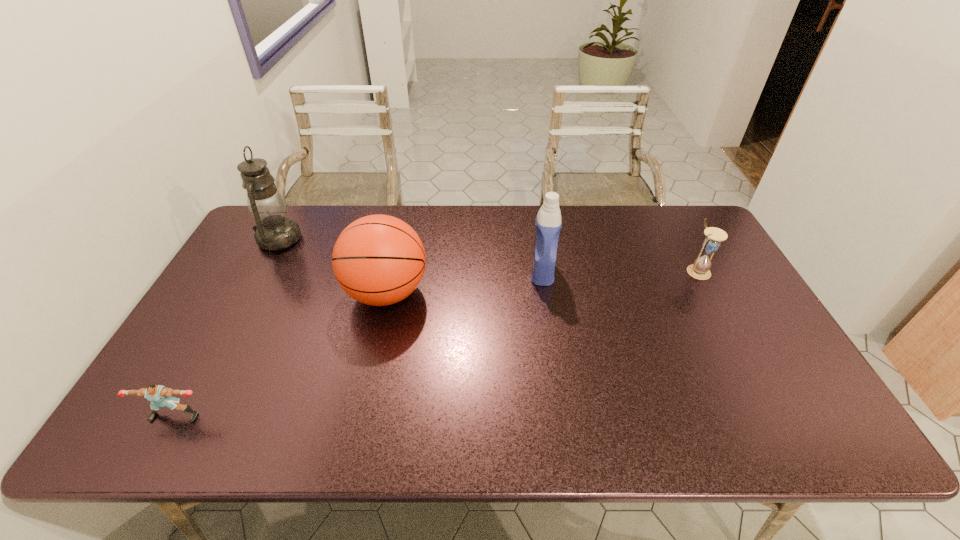
Where is `the second closest object relative to the detergent`? The image size is (960, 540). the second closest object relative to the detergent is located at coordinates (700, 269).

Identify which object is the fourth nearest to the shortest object. Please provide its 2D coordinates. Your answer should be formatted as a tuple, i.e. [(x, y)], where the tuple contains the x and y coordinates of a point satisfying the conditions above.

[(700, 269)]

Identify the location of vacant space that satisfies the following two spatial constraints: 1. on the front side of the tallest object; 2. on the right side of the detergent. (261, 272).

At what (x,y) coordinates should I click in order to perform the action: click on vacant point that satisfies the following two spatial constraints: 1. on the back side of the second shortest object; 2. on the right side of the fourth object from left to right. Please return your answer as a coordinate pair (x, y). This screenshot has width=960, height=540. Looking at the image, I should click on (542, 271).